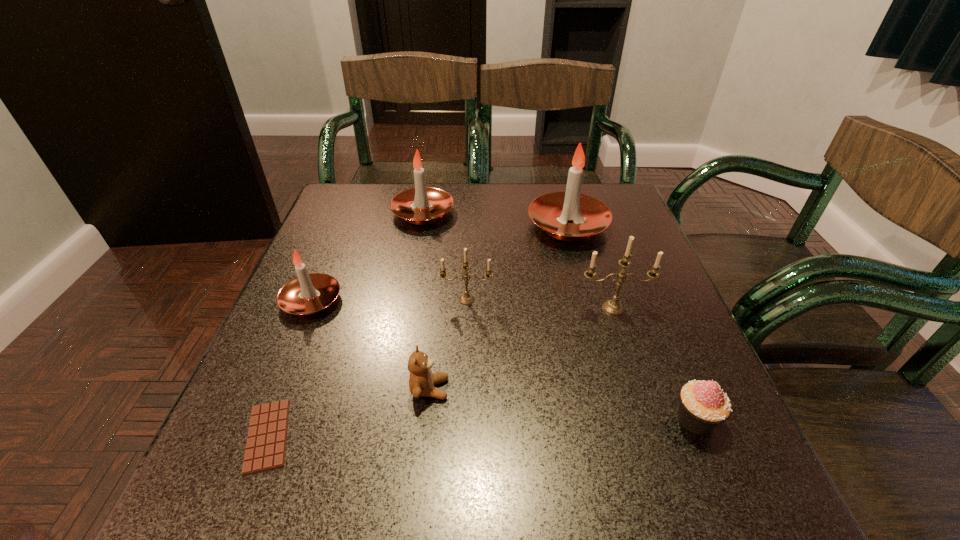
Identify the location of the tallest object. (553, 212).

At what (x,y) coordinates should I click in order to perform the action: click on the tallest candle. Please return your answer as a coordinate pair (x, y). This screenshot has width=960, height=540. Looking at the image, I should click on (553, 212).

Locate an element on the screen. the second white candle from right to left is located at coordinates (421, 205).

At what (x,y) coordinates should I click in order to perform the action: click on the bigger metallic candle. Please return your answer as a coordinate pair (x, y). The height and width of the screenshot is (540, 960). Looking at the image, I should click on (613, 307).

Find the location of a particular element. The image size is (960, 540). the leftmost candle is located at coordinates (308, 294).

The width and height of the screenshot is (960, 540). I want to click on the nearest white candle, so click(x=308, y=294).

I want to click on the left metallic candle, so click(x=466, y=299).

Find the location of a particular element. This screenshot has height=540, width=960. teddy bear is located at coordinates (421, 380).

You are a GUI agent. You are given a task and a screenshot of the screen. Output one action in this format:
    pyautogui.click(x=<x>, y=<y>)
    Task: Click on the pink cupcake
    
    Given the screenshot: What is the action you would take?
    pyautogui.click(x=703, y=405)

Identify the location of brown candy bar. (266, 443).